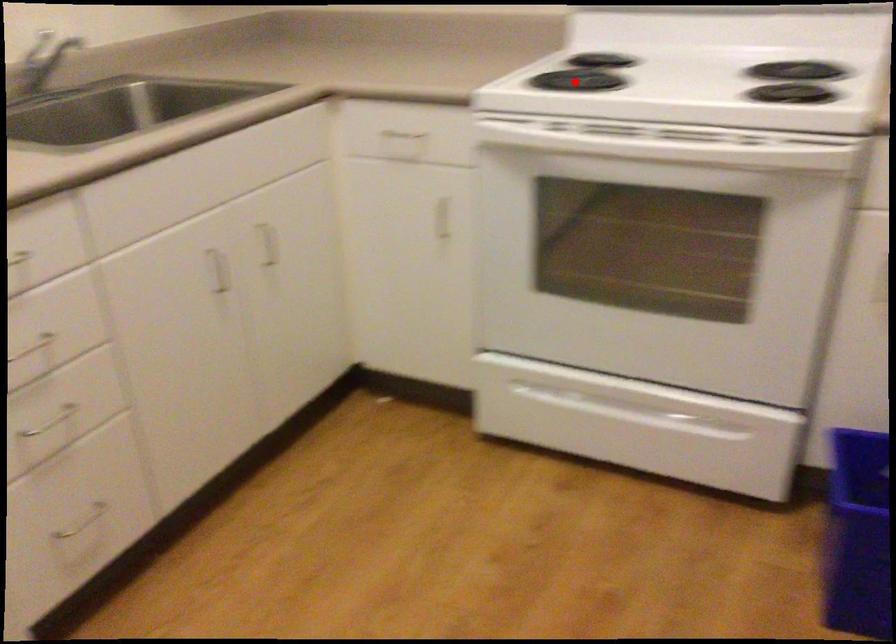
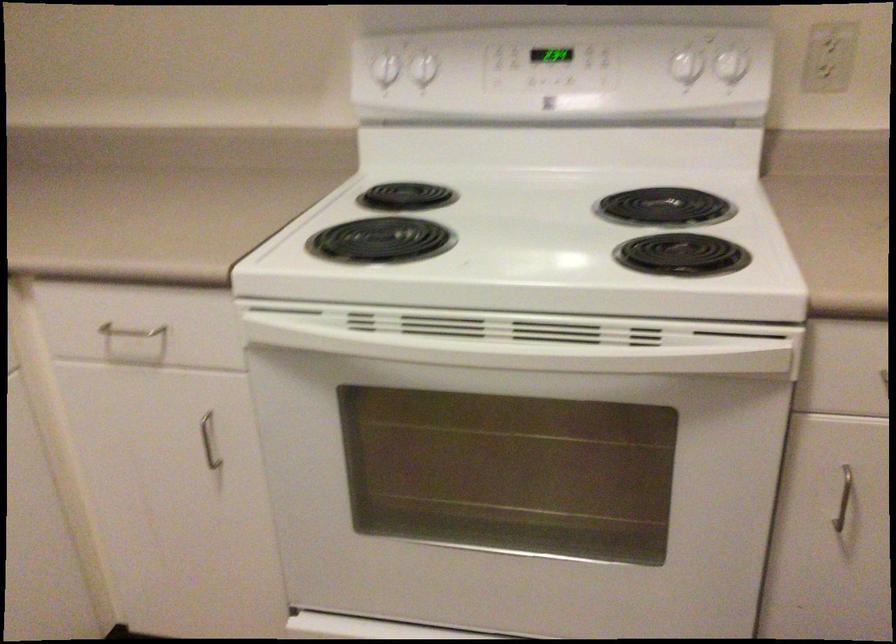
Question: A red point is marked in image1. In image2, is the corresponding 3D point closer to the camera or farther? Reply with the corresponding letter.

Choices:
 (A) The corresponding 3D point is closer.
 (B) The corresponding 3D point is farther.

Answer: (A)